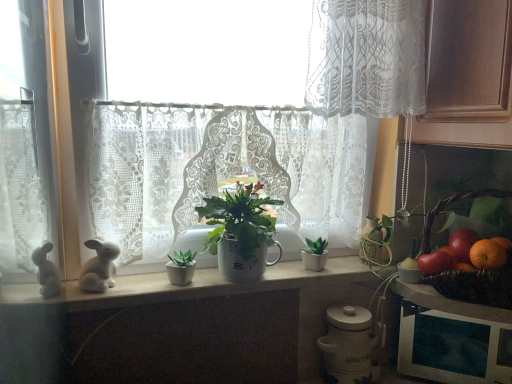
I want to click on free space above white matte counter top at center (from a real-world perspective), so click(x=208, y=279).